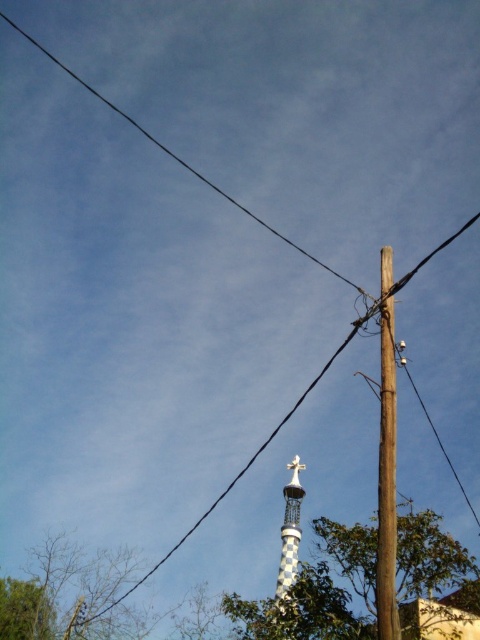
Does green leafy tree at center appear on the right side of checkerboard-patterned tower at center?

Yes, green leafy tree at center is to the right of checkerboard-patterned tower at center.

Who is taller, green leafy tree at center or checkerboard-patterned tower at center?

green leafy tree at center is taller.

Where is `green leafy tree at center`? This screenshot has width=480, height=640. green leafy tree at center is located at coordinates (317, 592).

What are the coordinates of `green leafy tree at center` in the screenshot? It's located at (317, 592).

Is point (297, 637) less distant than point (94, 625)?

Yes, point (297, 637) is in front of point (94, 625).

Measure the distance between green leafy tree at center and camera.

They are 100.56 meters apart.

The height and width of the screenshot is (640, 480). Describe the element at coordinates (317, 592) in the screenshot. I see `green leafy tree at center` at that location.

At what (x,y) coordinates should I click in order to perform the action: click on green leafy tree at center. Please return your answer as a coordinate pair (x, y). Looking at the image, I should click on (317, 592).

The height and width of the screenshot is (640, 480). What do you see at coordinates (71, 596) in the screenshot? I see `brown leafless tree at lower left` at bounding box center [71, 596].

Does brown leafless tree at lower left appear on the right side of checkerboard-patterned tower at center?

In fact, brown leafless tree at lower left is to the left of checkerboard-patterned tower at center.

At what (x,y) coordinates should I click in order to perform the action: click on brown leafless tree at lower left. Please return your answer as a coordinate pair (x, y). Image resolution: width=480 pixels, height=640 pixels. Looking at the image, I should click on (71, 596).